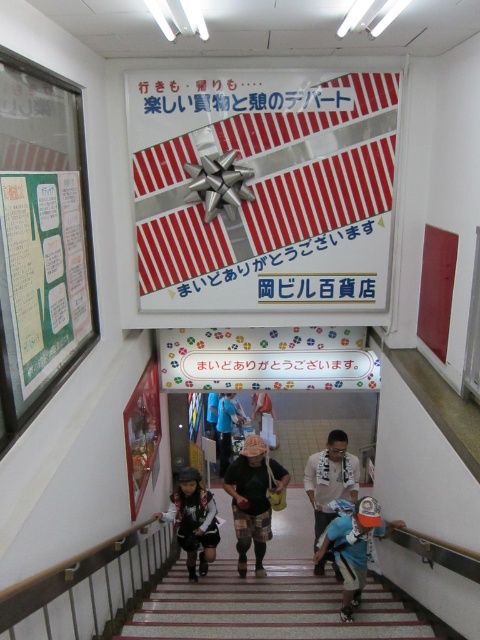
You are standing at the bottom of the staircase and want to hang a new sign that is 1 meter wide. The current signs include the silver metallic gift at upper center and the green paper at left. Which existing sign can fit the new sign if it needs to be wider than both?

The silver metallic gift at upper center might be wider than green paper at left, so the new sign that is 1 meter wide can fit if it is wider than the silver metallic gift at upper center.

You are a customer standing at the top of the staircase in the shopping area. You see a camouflage pants at center and a light blue fabric shirt at center. Which clothing item is positioned to the left when viewed from the staircase?

The camouflage pants at center is positioned on the left side of light blue fabric shirt at center, so the camouflage pants at center is to the left when viewed from the staircase.

You are standing at the top of the staircase and want to place a small decoration on either the striped carpet at lower center or the green paper at left. Which surface can accommodate a decoration that requires more vertical space?

The green paper at left can accommodate a decoration that requires more vertical space because it is taller than the striped carpet at lower center.